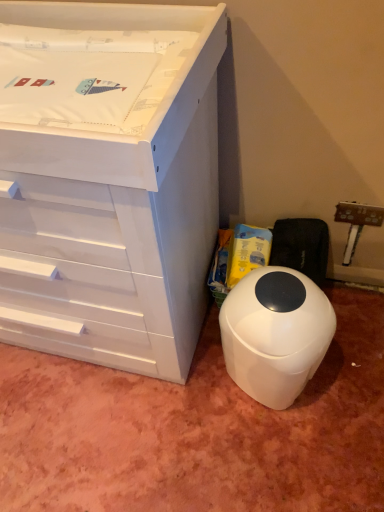
Measure the distance between point (65, 28) and camera.

Point (65, 28) and camera are 3.50 feet apart.

Image resolution: width=384 pixels, height=512 pixels. Find the location of `white glossy chest of drawers at upper left`. white glossy chest of drawers at upper left is located at coordinates (108, 180).

This screenshot has height=512, width=384. What do you see at coordinates (108, 180) in the screenshot?
I see `white glossy chest of drawers at upper left` at bounding box center [108, 180].

Find the location of a particular element. This screenshot has width=384, height=512. white plastic waste bin at lower right is located at coordinates (275, 333).

The width and height of the screenshot is (384, 512). What do you see at coordinates (275, 333) in the screenshot?
I see `white plastic waste bin at lower right` at bounding box center [275, 333].

Find the location of a particular element. This screenshot has width=384, height=512. white glossy chest of drawers at upper left is located at coordinates (108, 180).

Consider the image. Is white plastic waste bin at lower right at the left side of white glossy chest of drawers at upper left?

No, white plastic waste bin at lower right is not to the left of white glossy chest of drawers at upper left.

Which object is closer to the camera taking this photo, white plastic waste bin at lower right or white glossy chest of drawers at upper left?

white glossy chest of drawers at upper left is more forward.

Considering the positions of point (284, 351) and point (190, 340), is point (284, 351) closer or farther from the camera than point (190, 340)?

Point (284, 351) is positioned closer to the camera compared to point (190, 340).

From the image's perspective, which is above, white plastic waste bin at lower right or white glossy chest of drawers at upper left?

white glossy chest of drawers at upper left is shown above in the image.

From a real-world perspective, which object stands above the other?

In real-world perspective, white glossy chest of drawers at upper left is above.

Is white plastic waste bin at lower right wider than white glossy chest of drawers at upper left?

No, white plastic waste bin at lower right is not wider than white glossy chest of drawers at upper left.

Which of these two, white plastic waste bin at lower right or white glossy chest of drawers at upper left, stands shorter?

With less height is white plastic waste bin at lower right.

Considering the sizes of white plastic waste bin at lower right and white glossy chest of drawers at upper left in the image, is white plastic waste bin at lower right bigger or smaller than white glossy chest of drawers at upper left?

Clearly, white plastic waste bin at lower right is smaller in size than white glossy chest of drawers at upper left.

Choose the correct answer: Is white plastic waste bin at lower right inside white glossy chest of drawers at upper left or outside it?

white plastic waste bin at lower right exists outside the volume of white glossy chest of drawers at upper left.

Is the surface of white plastic waste bin at lower right in direct contact with white glossy chest of drawers at upper left?

No, white plastic waste bin at lower right is not with white glossy chest of drawers at upper left.

Could you tell me if white plastic waste bin at lower right is facing white glossy chest of drawers at upper left?

No, white plastic waste bin at lower right is not oriented towards white glossy chest of drawers at upper left.

How different are the orientations of white plastic waste bin at lower right and white glossy chest of drawers at upper left in degrees?

The angular difference between white plastic waste bin at lower right and white glossy chest of drawers at upper left is 0.228 degrees.

Identify the location of the chest of drawers above the white plastic waste bin at lower right (from the image's perspective). (108, 180).

Is white glossy chest of drawers at upper left at the left side of white plastic waste bin at lower right?

Yes.

In the image, is white glossy chest of drawers at upper left positioned in front of or behind white plastic waste bin at lower right?

Visually, white glossy chest of drawers at upper left is located in front of white plastic waste bin at lower right.

Considering the positions of points (180, 243) and (299, 342), is point (180, 243) farther from camera compared to point (299, 342)?

That is False.

Looking at this image, from the image's perspective, which one is positioned higher, white glossy chest of drawers at upper left or white plastic waste bin at lower right?

white glossy chest of drawers at upper left.

From a real-world perspective, who is located lower, white glossy chest of drawers at upper left or white plastic waste bin at lower right?

white plastic waste bin at lower right is physically lower.

Considering the sizes of white glossy chest of drawers at upper left and white plastic waste bin at lower right in the image, is white glossy chest of drawers at upper left wider or thinner than white plastic waste bin at lower right?

In the image, white glossy chest of drawers at upper left appears to be wider than white plastic waste bin at lower right.

Is white glossy chest of drawers at upper left taller or shorter than white plastic waste bin at lower right?

Clearly, white glossy chest of drawers at upper left is taller compared to white plastic waste bin at lower right.

Is white glossy chest of drawers at upper left smaller than white plastic waste bin at lower right?

Actually, white glossy chest of drawers at upper left might be larger than white plastic waste bin at lower right.

Would you say white plastic waste bin at lower right is part of white glossy chest of drawers at upper left's contents?

No.

Are white glossy chest of drawers at upper left and white plastic waste bin at lower right beside each other?

No, white glossy chest of drawers at upper left is not touching white plastic waste bin at lower right.

Does white glossy chest of drawers at upper left turn towards white plastic waste bin at lower right?

No, white glossy chest of drawers at upper left is not turned towards white plastic waste bin at lower right.

How far apart are white glossy chest of drawers at upper left and white plastic waste bin at lower right?

The distance of white glossy chest of drawers at upper left from white plastic waste bin at lower right is 15.03 inches.

Find the location of `the chest of drawers positioned vertically above the white plastic waste bin at lower right (from a real-world perspective)`. the chest of drawers positioned vertically above the white plastic waste bin at lower right (from a real-world perspective) is located at coordinates (108, 180).

The image size is (384, 512). I want to click on chest of drawers in front of the white plastic waste bin at lower right, so click(108, 180).

At what (x,y) coordinates should I click in order to perform the action: click on the chest of drawers located above the white plastic waste bin at lower right (from the image's perspective). Please return your answer as a coordinate pair (x, y). This screenshot has width=384, height=512. Looking at the image, I should click on (108, 180).